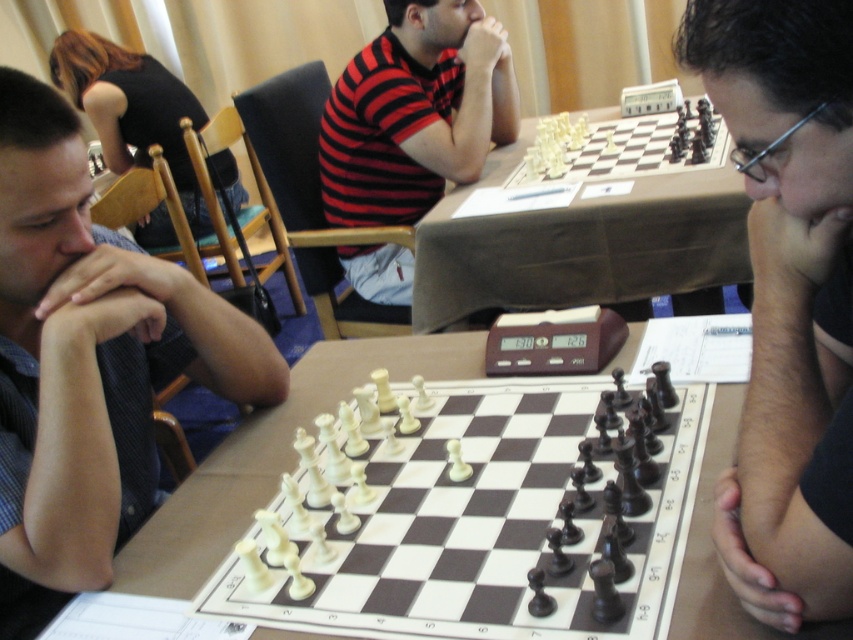
Question: Can you confirm if matte black chess pieces at center is positioned below white wooden table at center?

Choices:
 (A) no
 (B) yes

Answer: (A)

Question: Is matte black chess pieces at center positioned at the back of brown fabric table at center?

Choices:
 (A) yes
 (B) no

Answer: (B)

Question: Considering the real-world distances, which object is closest to the brown fabric table at center?

Choices:
 (A) striped cotton shirt at center
 (B) white plastic chess pieces at center

Answer: (B)

Question: Among these objects, which one is nearest to the camera?

Choices:
 (A) blue striped shirt at left
 (B) matte black chess pieces at center
 (C) striped cotton shirt at center

Answer: (B)

Question: Among these points, which one is farthest from the camera?

Choices:
 (A) (705, 180)
 (B) (461, 40)
 (C) (611, 163)

Answer: (B)

Question: Can you confirm if matte black chess pieces at center is wider than white plastic chess pieces at center?

Choices:
 (A) yes
 (B) no

Answer: (B)